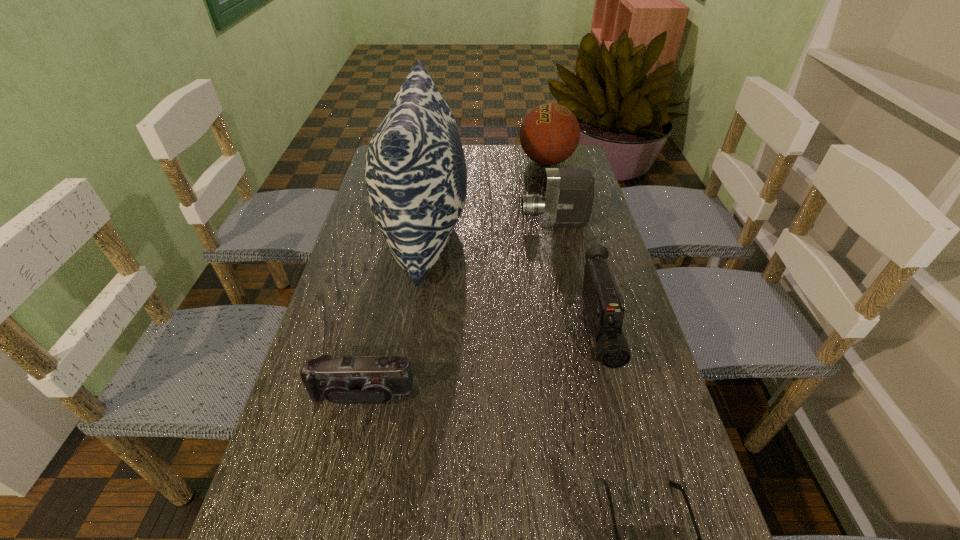
At what (x,y) coordinates should I click in order to perform the action: click on vacant area that satisfies the following two spatial constraints: 1. on the front surface of the cushion; 2. on the front-facing side of the leftmost camcorder. Please return your answer as a coordinate pair (x, y). The height and width of the screenshot is (540, 960). Looking at the image, I should click on (402, 393).

I want to click on vacant area in the image that satisfies the following two spatial constraints: 1. at the front of the farthest camcorder, highlighting the lens; 2. on the front-facing side of the second shortest object, so pos(589,393).

Locate an element on the screen. free space in the image that satisfies the following two spatial constraints: 1. on the front surface of the tallest object; 2. on the front-facing side of the second shortest object is located at coordinates (402, 393).

You are a GUI agent. You are given a task and a screenshot of the screen. Output one action in this format:
    pyautogui.click(x=<x>, y=<y>)
    Task: Click on the vacant space that satisfies the following two spatial constraints: 1. at the front of the farthest camcorder, highlighting the lens; 2. on the front-facing side of the fifth tallest object
    
    Given the screenshot: What is the action you would take?
    pyautogui.click(x=589, y=393)

Locate an element on the screen. This screenshot has height=540, width=960. free space that satisfies the following two spatial constraints: 1. on the front surface of the tallest object; 2. on the front-facing side of the second shortest object is located at coordinates (402, 393).